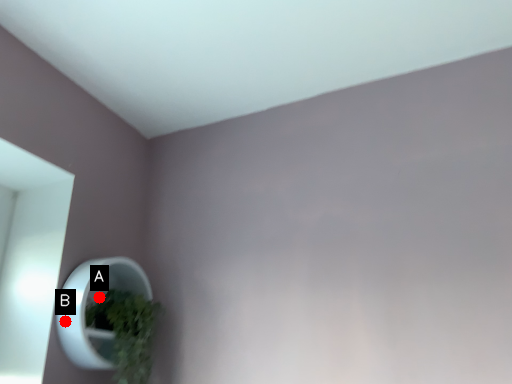
Question: Two points are circled on the image, labeled by A and B beside each circle. Which point appears farthest from the camera in this image?

Choices:
 (A) A is further
 (B) B is further

Answer: (A)